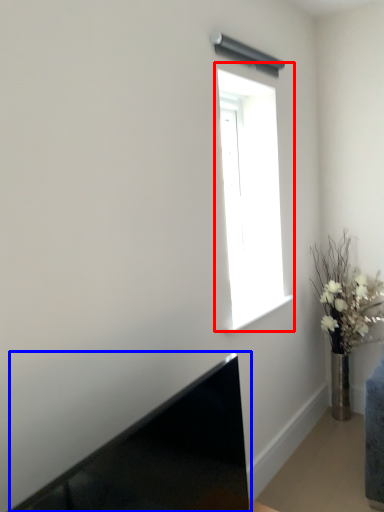
Question: Which point is closer to the camera, window (highlighted by a red box) or laptop (highlighted by a blue box)?

Choices:
 (A) window
 (B) laptop

Answer: (B)